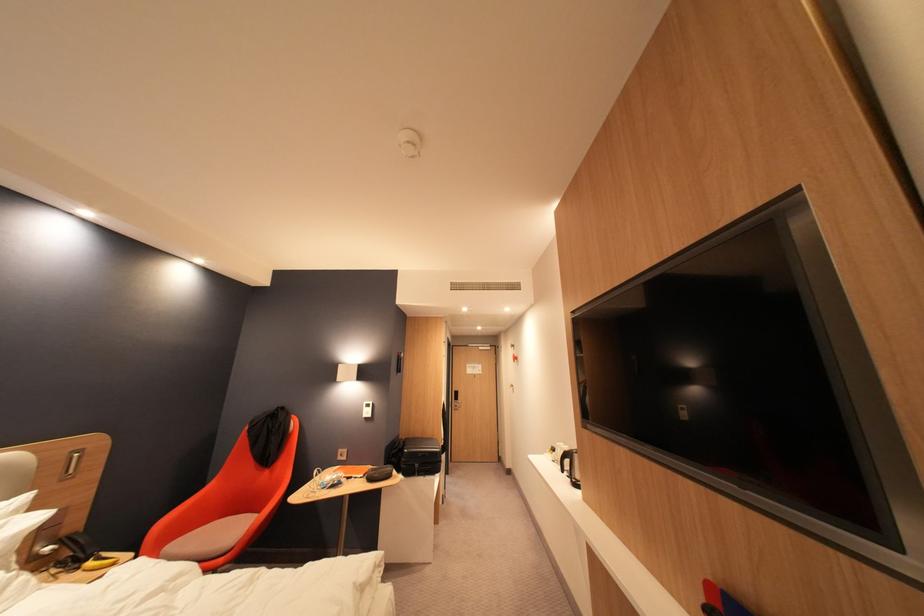
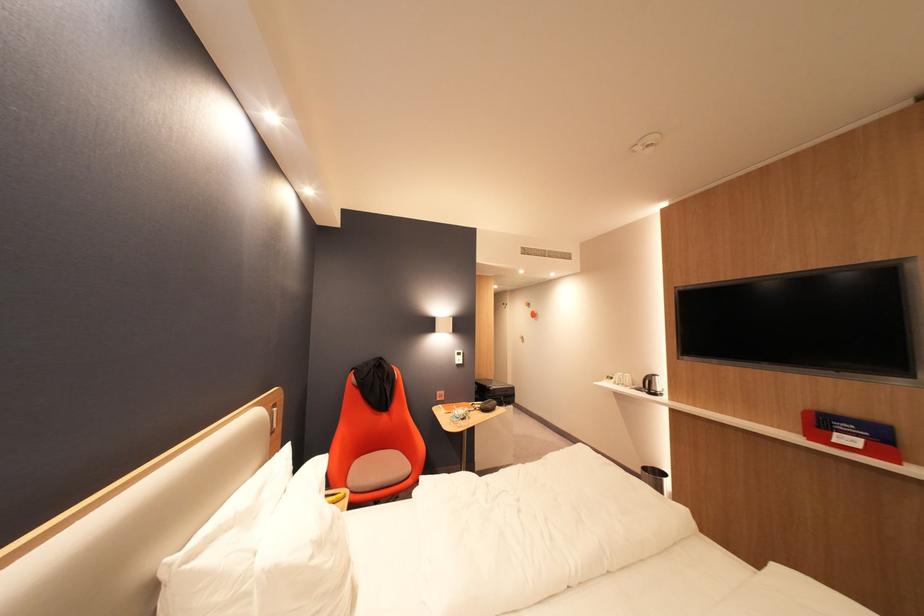
Find the pixel in the second image that matches [564,452] in the first image.

(622, 379)